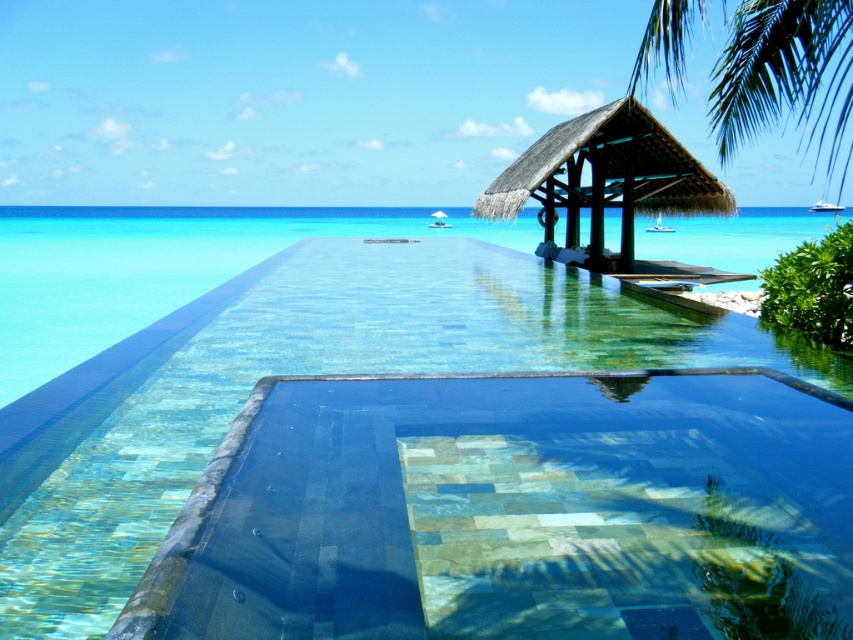
You are planning to install a new lighting system for the translucent mosaic pool at center and the thatched roof gazebo at upper right. Based on their positions, which object is located above the other?

The thatched roof gazebo at upper right is above the translucent mosaic pool at center since the pool is positioned under it.

You are a photographer planning to capture the translucent mosaic pool at center and the green leafy palm tree at upper right in a single frame. Based on their sizes, which object would appear smaller in the photo?

→ The translucent mosaic pool at center would appear smaller in the photo because it is thinner than the green leafy palm tree at upper right.